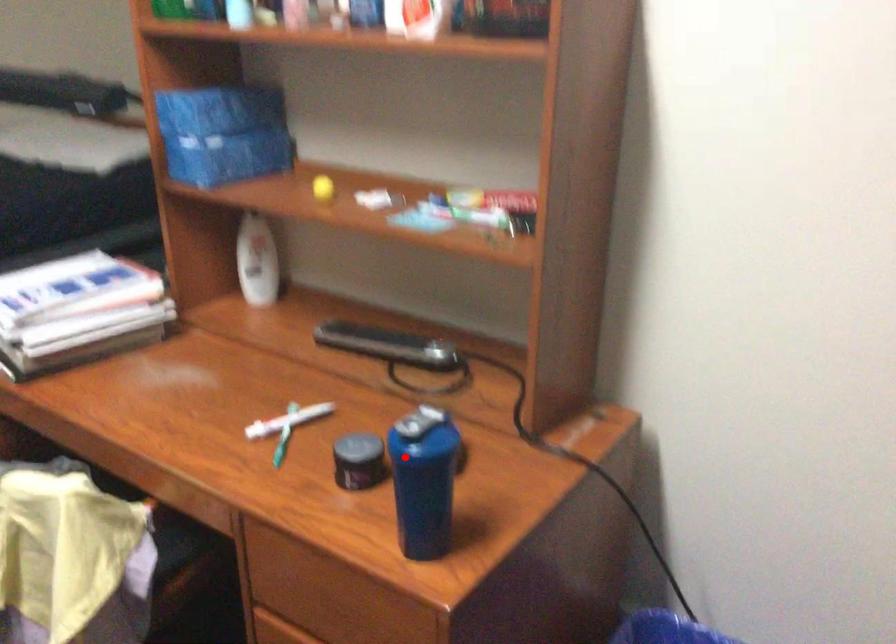
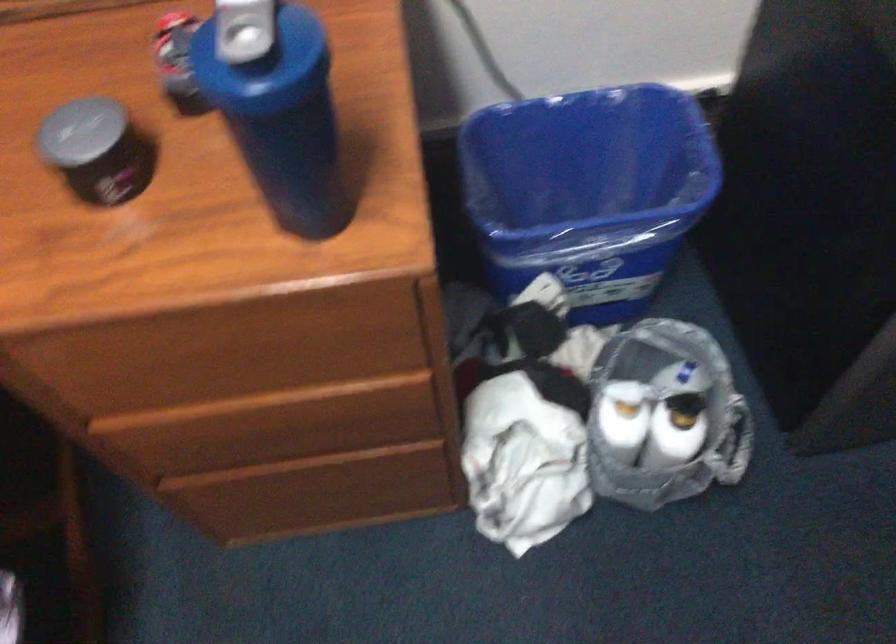
Question: I am providing you with two images of the same scene from different viewpoints. A red point is shown in image1. For the corresponding object point in image2, is it positioned nearer or farther from the camera?

Choices:
 (A) Nearer
 (B) Farther

Answer: (A)